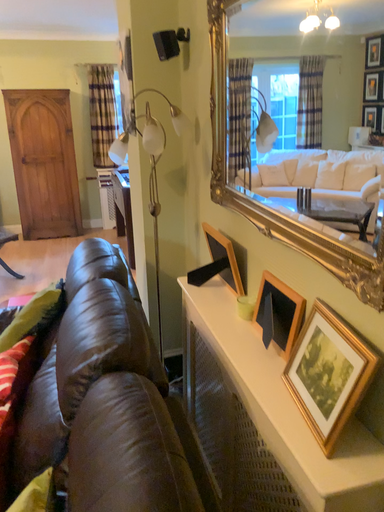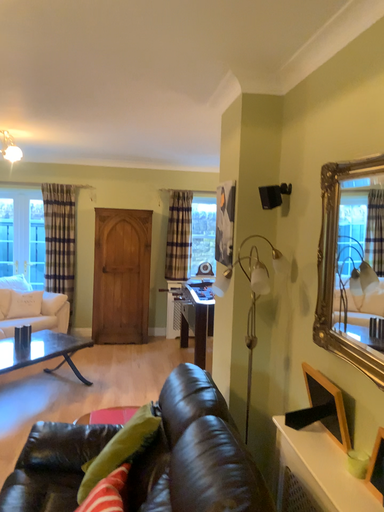
Question: Which way did the camera rotate in the video?

Choices:
 (A) rotated downward
 (B) rotated upward

Answer: (B)